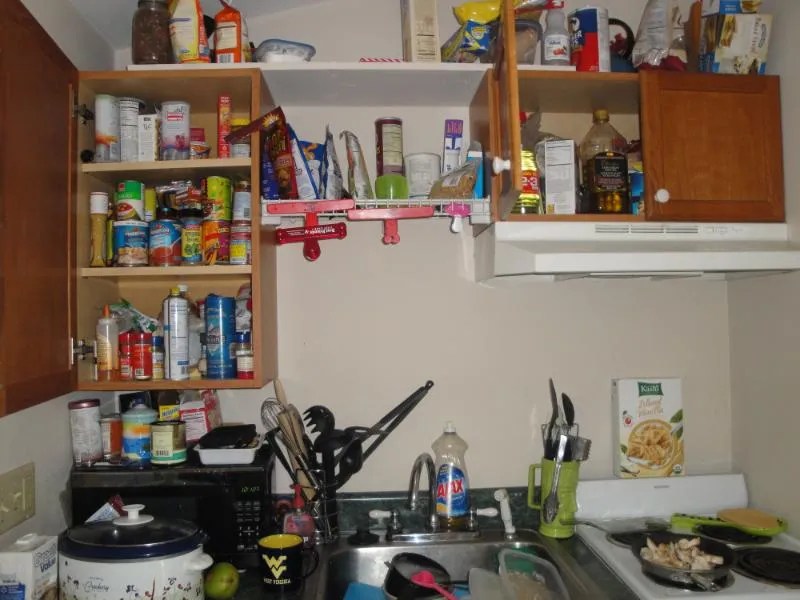
Locate an element on the screen. hinges is located at coordinates (72, 114), (74, 351).